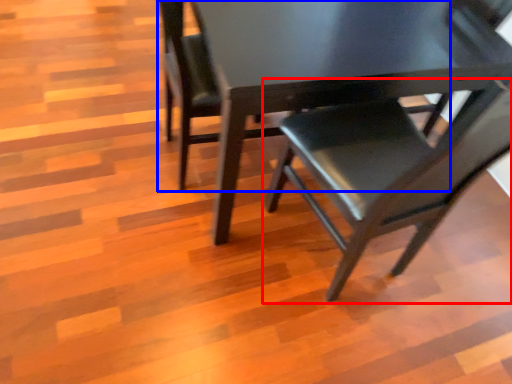
Question: Among these objects, which one is nearest to the camera, chair (highlighted by a red box) or chair (highlighted by a blue box)?

Choices:
 (A) chair
 (B) chair

Answer: (A)